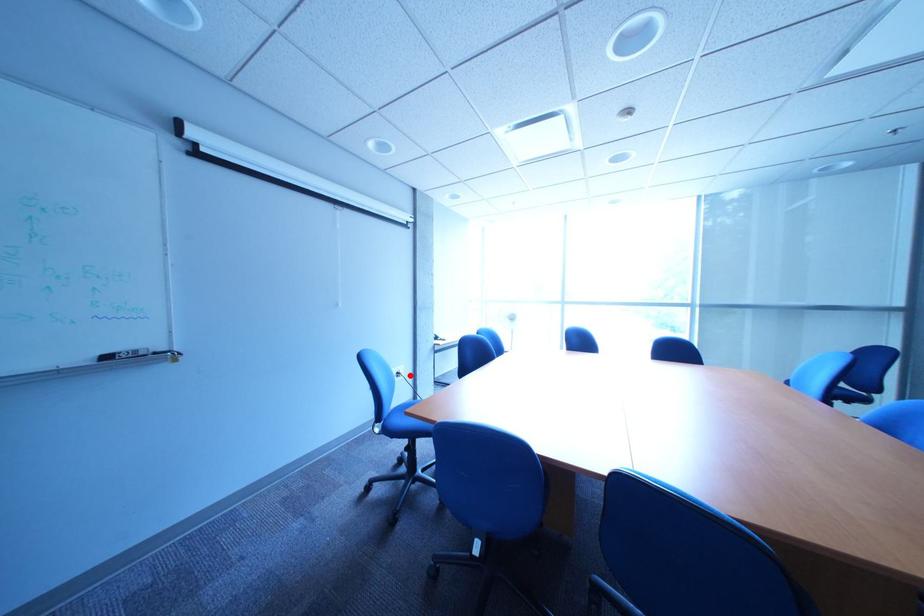
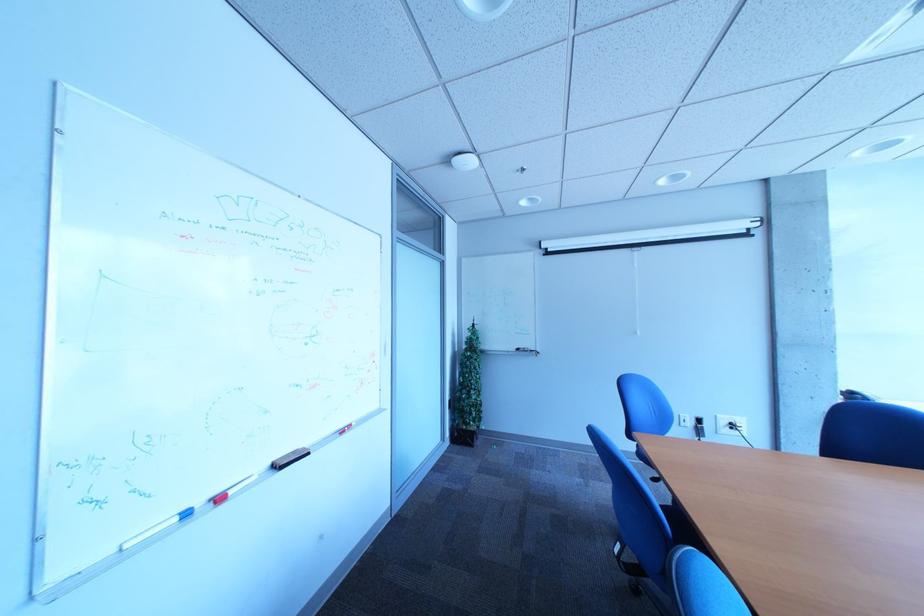
The point at the highlighted location is marked in the first image. Where is the corresponding point in the second image?

(739, 424)